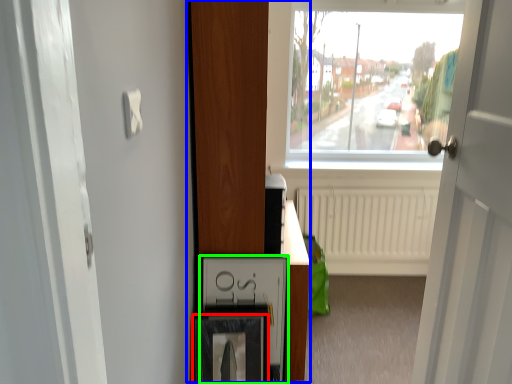
Question: Which is farther away from picture frame (highlighted by a red box)? dresser (highlighted by a blue box) or medicine cabinet (highlighted by a green box)?

Choices:
 (A) dresser
 (B) medicine cabinet

Answer: (A)